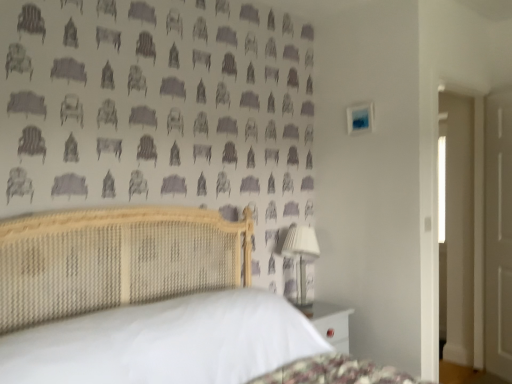
Question: Is white fabric-covered lampshade at right bigger than woven wood bed at center?

Choices:
 (A) no
 (B) yes

Answer: (A)

Question: Is the depth of white fabric-covered lampshade at right less than that of woven wood bed at center?

Choices:
 (A) no
 (B) yes

Answer: (A)

Question: Are white fabric-covered lampshade at right and woven wood bed at center making contact?

Choices:
 (A) no
 (B) yes

Answer: (A)

Question: Is woven wood bed at center completely or partially inside white fabric-covered lampshade at right?

Choices:
 (A) yes
 (B) no

Answer: (B)

Question: Is white fabric-covered lampshade at right thinner than woven wood bed at center?

Choices:
 (A) no
 (B) yes

Answer: (B)

Question: Does white fabric-covered lampshade at right lie behind woven wood bed at center?

Choices:
 (A) no
 (B) yes

Answer: (B)

Question: From the image's perspective, is white matte door at right located beneath woven wood bed at center?

Choices:
 (A) no
 (B) yes

Answer: (A)

Question: Is white matte door at right surrounding woven wood bed at center?

Choices:
 (A) yes
 (B) no

Answer: (B)

Question: From the image's perspective, would you say white matte door at right is positioned over woven wood bed at center?

Choices:
 (A) no
 (B) yes

Answer: (B)

Question: Is there a large distance between white matte door at right and woven wood bed at center?

Choices:
 (A) yes
 (B) no

Answer: (A)

Question: Considering the relative positions of white matte door at right and woven wood bed at center in the image provided, is white matte door at right in front of woven wood bed at center?

Choices:
 (A) no
 (B) yes

Answer: (A)

Question: Can you confirm if white matte door at right is positioned to the right of woven wood bed at center?

Choices:
 (A) no
 (B) yes

Answer: (B)

Question: Does white matte door at right have a lesser width compared to white fabric-covered lampshade at right?

Choices:
 (A) yes
 (B) no

Answer: (A)